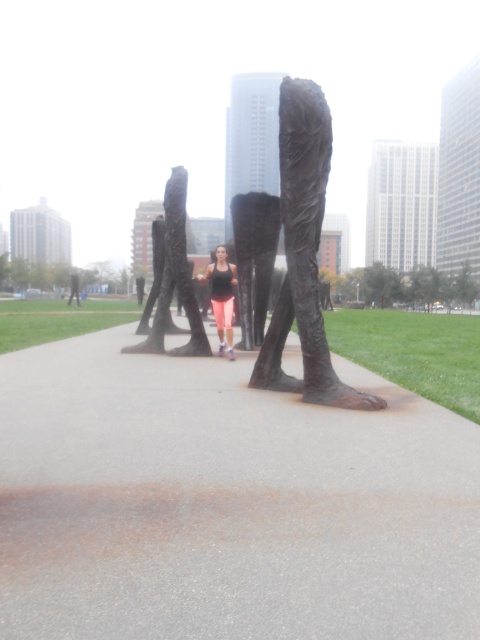
You are standing at the point labeled point (227, 502) in the image. What material are you standing on?

You are standing on gray concrete pavement at center.

You are standing at the curved pathway in the urban park scene. You see two points marked on the ground, one at coordinates point (324,205) and the other at point (148,339). Which point is nearer to you?

Point (324,205) is closer to the viewer than point (148,339).